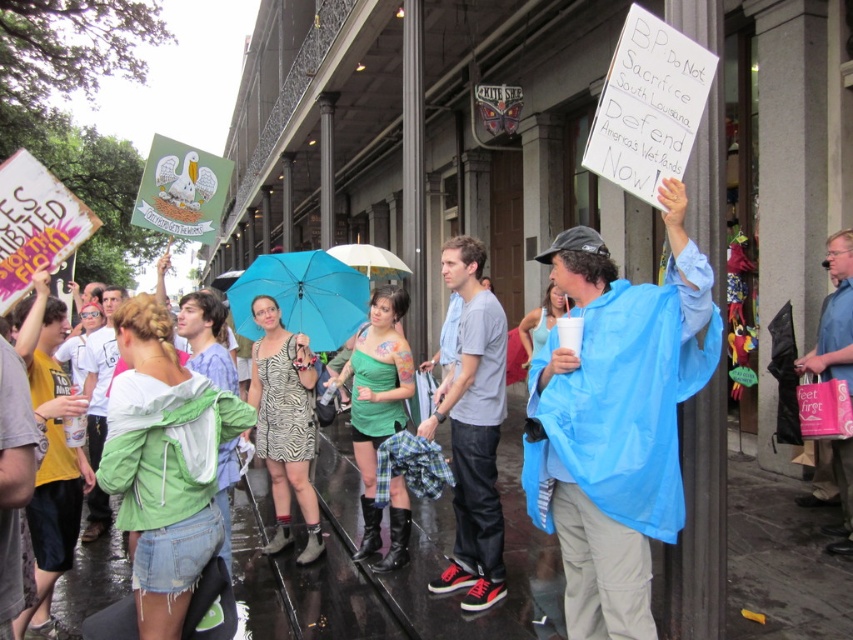
You are a photographer trying to capture a clear shot of the pink fabric bag at right. Based on its coordinates, where should you position yourself relative to the main protest crowd to ensure it is centered in your frame?

The pink fabric bag at right is located at point (834,317), which is near the lower right corner of the image. To center it in your frame, position yourself slightly to the right and lower down relative to the main protest crowd.